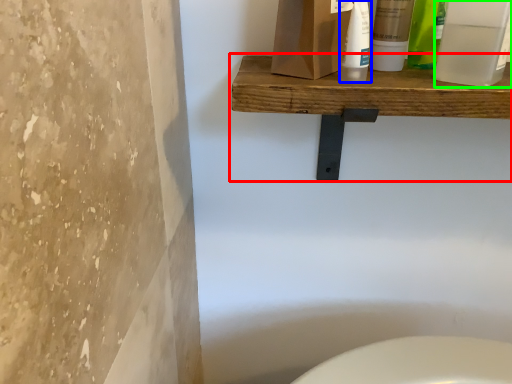
Question: Which object is the farthest from shelf (highlighted by a red box)? Choose among these: cleaning product (highlighted by a blue box) or mouthwash (highlighted by a green box).

Choices:
 (A) cleaning product
 (B) mouthwash

Answer: (B)